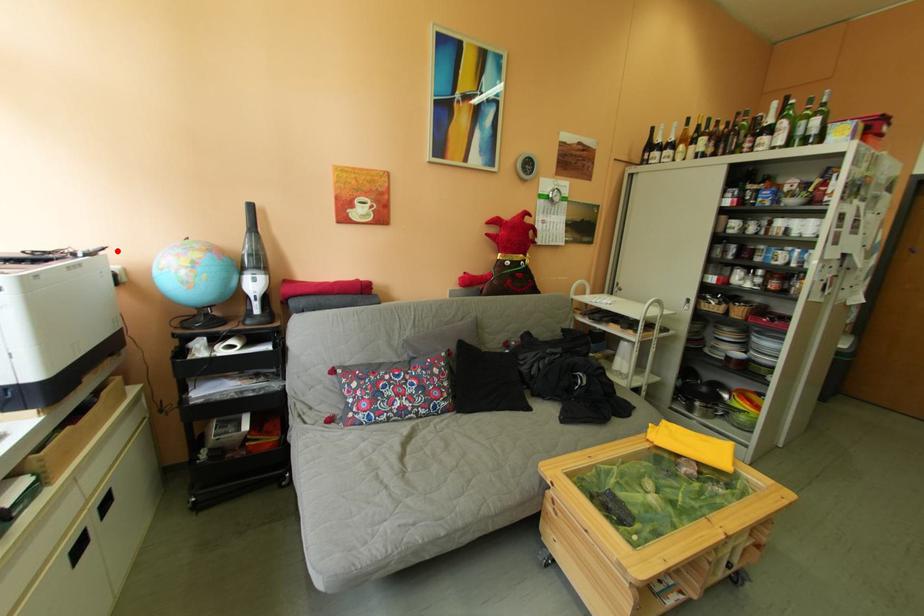
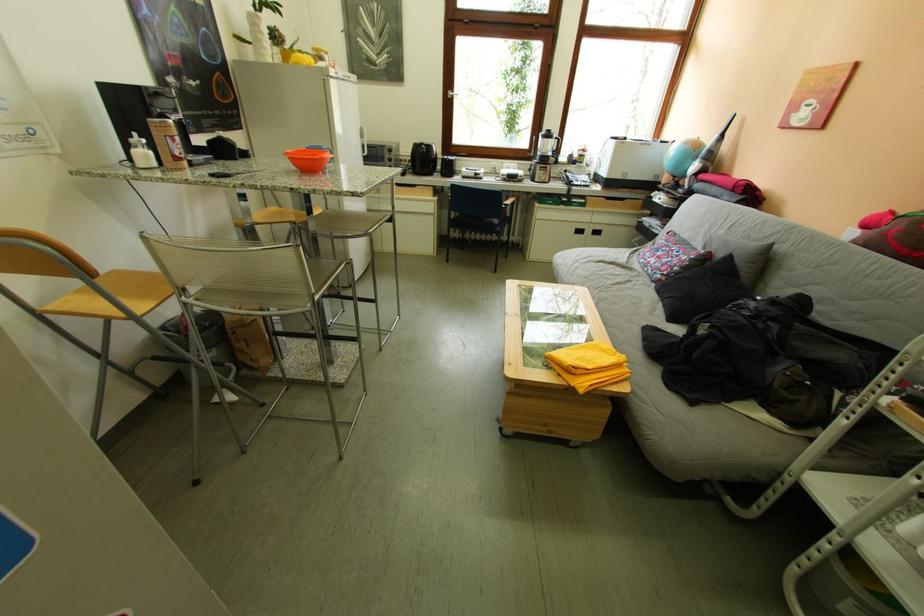
Find the pixel in the second image that matches the highlighted location in the first image.

(687, 145)